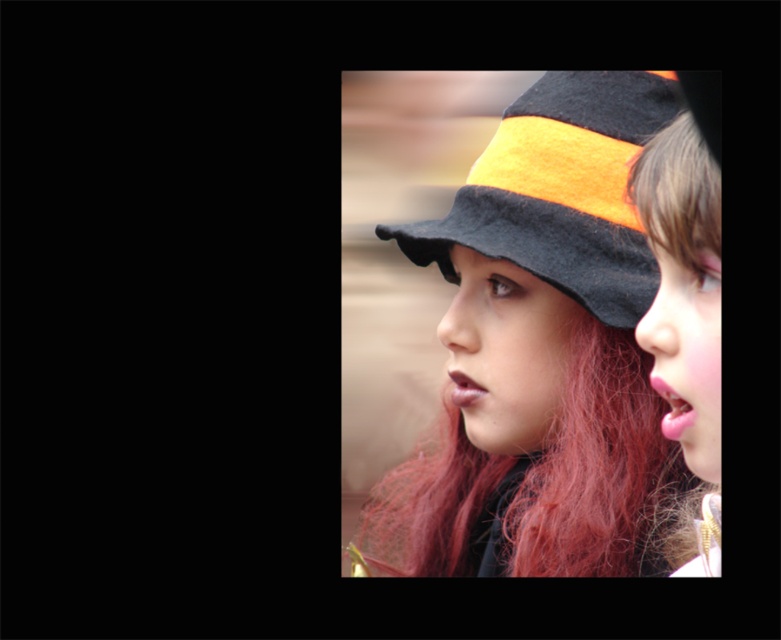
Question: Which point is closer to the camera?

Choices:
 (A) (615, 224)
 (B) (703, 352)
 (C) (676, 177)
 (D) (601, 196)

Answer: (B)

Question: Does matte felt hat at center appear on the left side of blonde silky hair at upper right?

Choices:
 (A) no
 (B) yes

Answer: (B)

Question: Among these objects, which one is nearest to the camera?

Choices:
 (A) smooth orange hat at right
 (B) blonde silky hair at upper right
 (C) orange felt hat at center

Answer: (A)

Question: Is smooth orange hat at right to the left of blonde silky hair at upper right from the viewer's perspective?

Choices:
 (A) no
 (B) yes

Answer: (A)

Question: Which point appears farthest from the camera in this image?

Choices:
 (A) (580, 380)
 (B) (705, 227)
 (C) (719, 470)

Answer: (A)

Question: Does orange felt hat at center have a greater width compared to smooth orange hat at right?

Choices:
 (A) yes
 (B) no

Answer: (A)